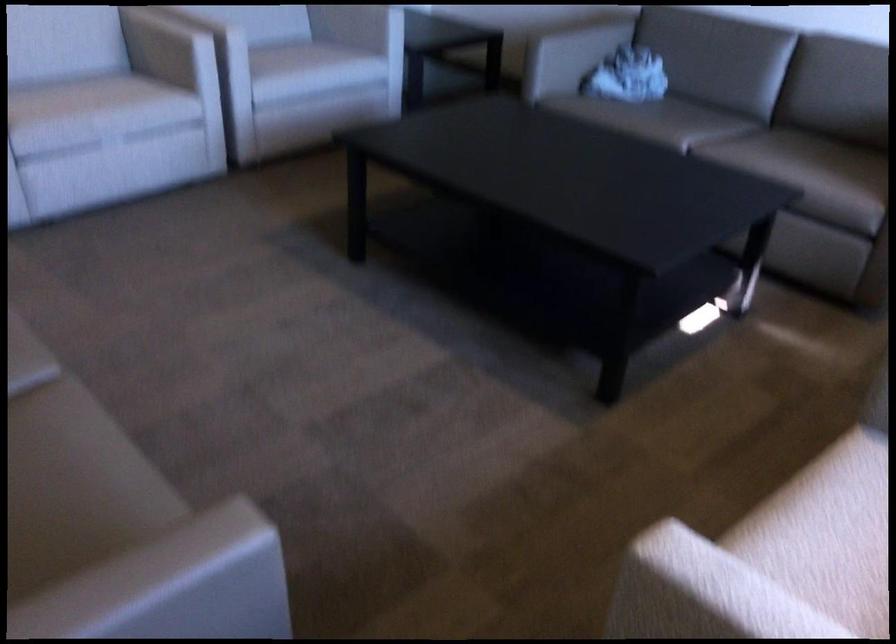
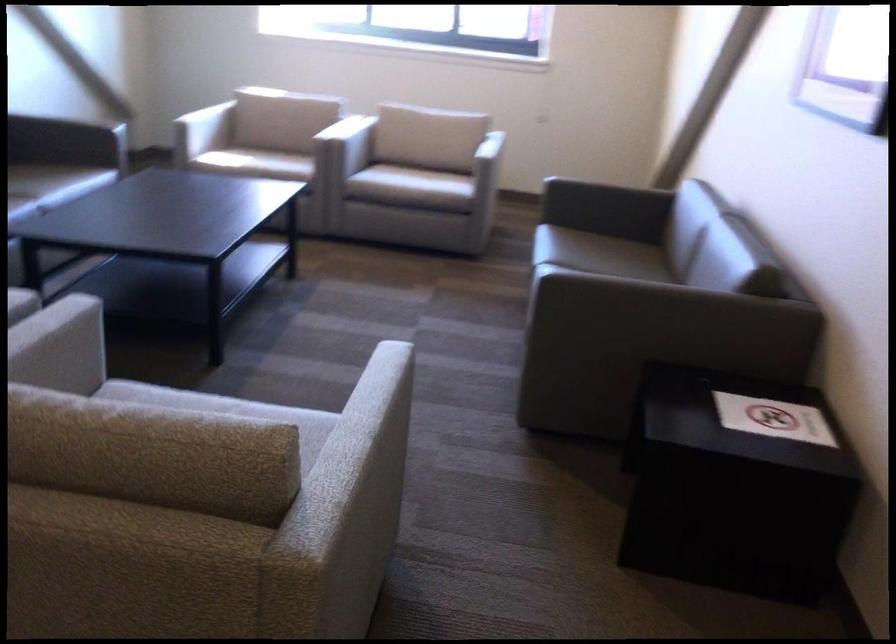
Question: I am providing you with two images of the same scene from different viewpoints. After the viewpoint changes to image2, which objects are now occluded?

Choices:
 (A) food cover handle
 (B) white chair armrest
 (C) sofa sitting surface
 (D) chair armrest

Answer: (B)